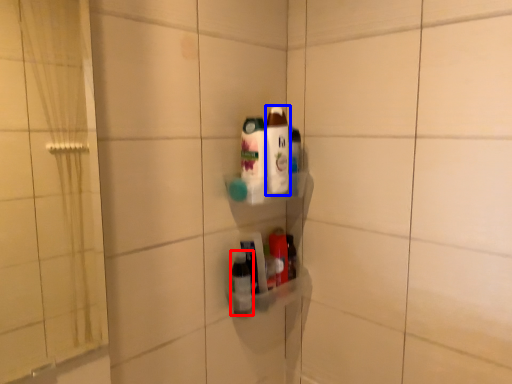
Question: Which object appears farthest to the camera in this image, bottle (highlighted by a red box) or bottle (highlighted by a blue box)?

Choices:
 (A) bottle
 (B) bottle

Answer: (A)